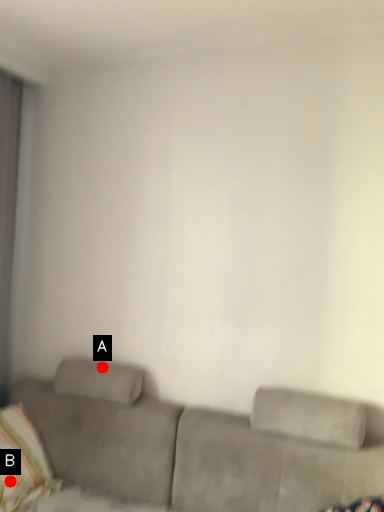
Question: Two points are circled on the image, labeled by A and B beside each circle. Which point is closer to the camera taking this photo?

Choices:
 (A) A is closer
 (B) B is closer

Answer: (B)